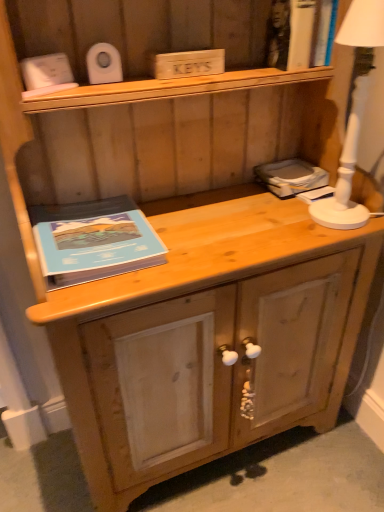
The height and width of the screenshot is (512, 384). Identify the location of free spot above blue matte book at left (from a real-world perspective). (86, 232).